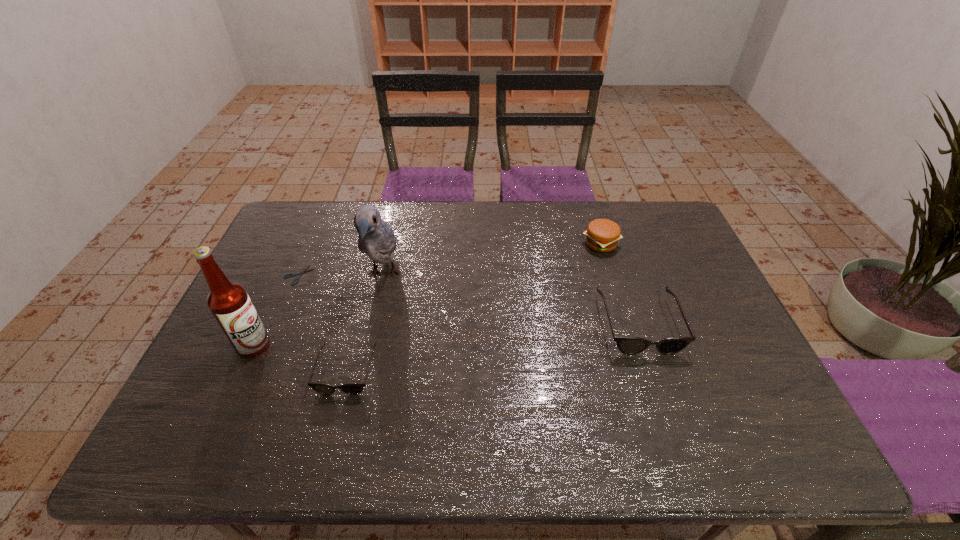
Where is `the left sunglasses`? the left sunglasses is located at coordinates (351, 388).

Identify the location of the second shortest object. The width and height of the screenshot is (960, 540). tap(351, 388).

Where is `the right sunglasses`? the right sunglasses is located at coordinates (628, 345).

I want to click on alcohol, so click(229, 302).

Identify the location of hamburger. The image size is (960, 540). (602, 235).

Find the location of a particular element. the second tallest object is located at coordinates (376, 238).

Where is `shears`? shears is located at coordinates (303, 271).

In order to click on vacant space located on the front lenses of the taller sunglasses in this screenshot , I will do `click(665, 404)`.

Locate an element on the screen. This screenshot has height=540, width=960. vacant space located 0.250m on the label side of the alcohol is located at coordinates (365, 345).

This screenshot has width=960, height=540. Find the location of `vacant space located on the left of the hamburger`. vacant space located on the left of the hamburger is located at coordinates (542, 244).